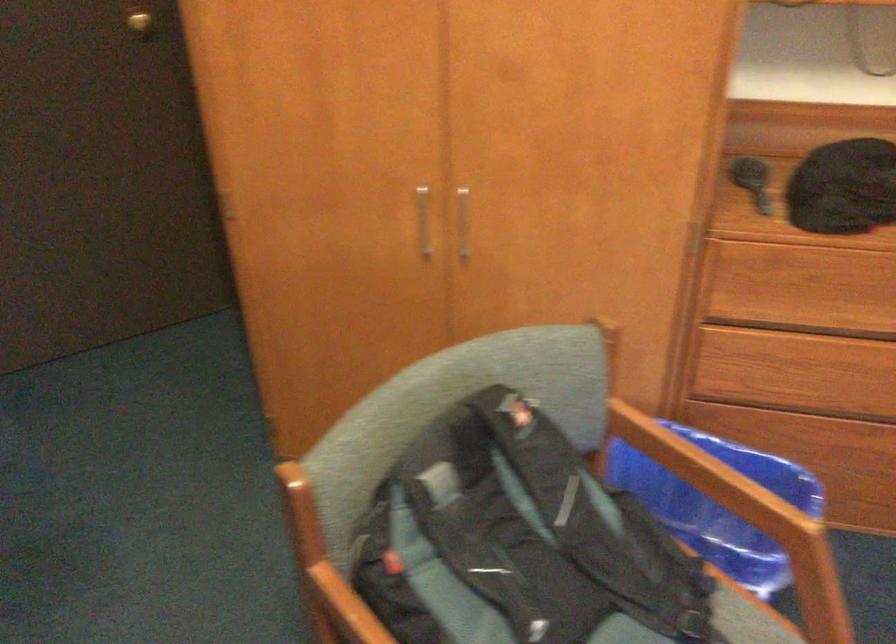
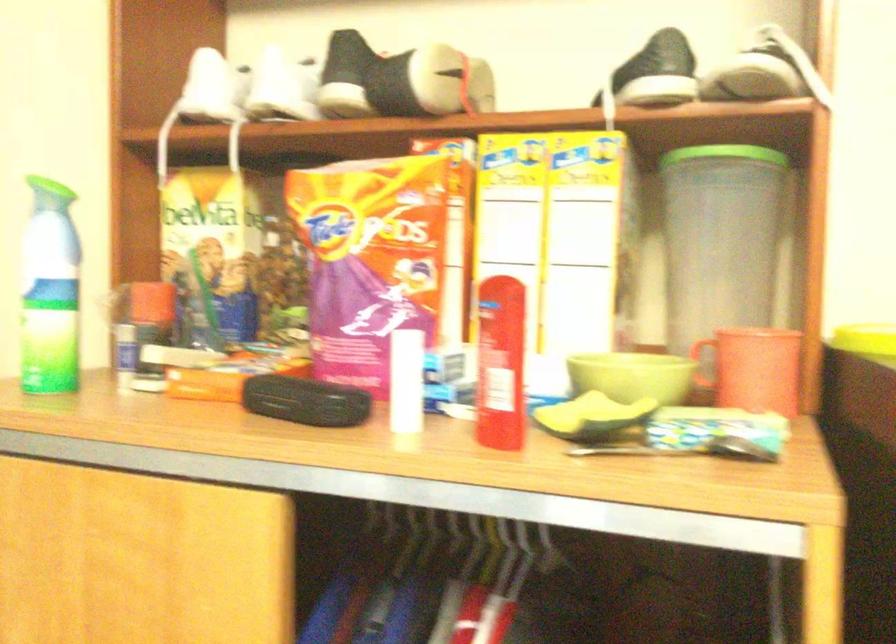
Question: The first image is from the beginning of the video and the second image is from the end. How did the camera likely rotate when shooting the video?

Choices:
 (A) Left
 (B) Right
 (C) Up
 (D) Down

Answer: (A)